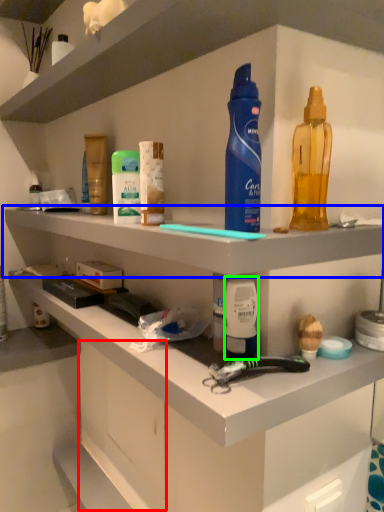
Question: Which object is positioned closest to drawer (highlighted by a red box)? Select from shelf (highlighted by a blue box) and toiletry (highlighted by a green box).

Choices:
 (A) shelf
 (B) toiletry

Answer: (A)